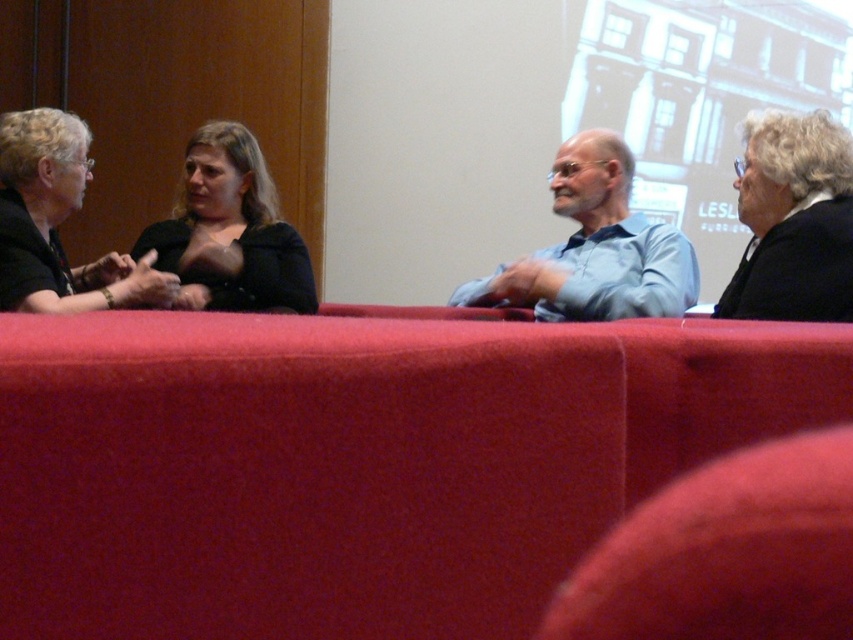
Consider the image. You are an event organizer arranging a photo shoot in the conference room. You need to ensure that the black woolen jacket at right and the matte black jacket at left are visible in the photo. Based on their positions, which jacket is closer to the camera? Explain your reasoning.

The black woolen jacket at right is located below the matte black jacket at left, meaning the matte black jacket at left is closer to the camera since it is positioned higher in the image. However, since both jackets are matte black and the scene has similar lighting, distinguishing them might be challenging. To ensure visibility, adjust the camera angle to capture both clearly.

You are organizing a photo shoot and need to ensure that all clothing items in the image are visible. Given the light blue shirt at center and the matte black jacket at left, which clothing item might require more careful lighting to ensure visibility?

The light blue shirt at center is bigger than matte black jacket at left, so it might require more careful lighting to ensure visibility.